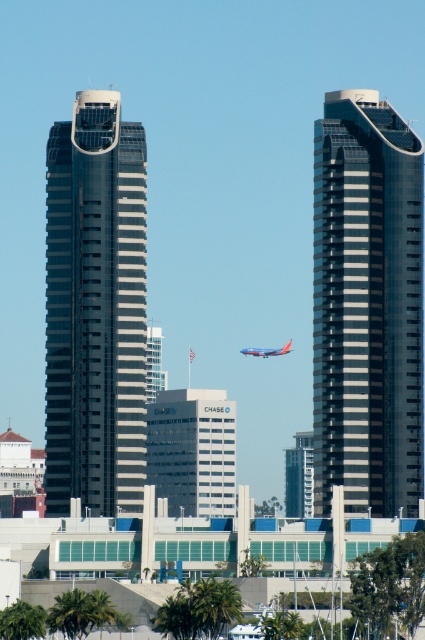
Which is in front, point (354, 465) or point (306, 483)?

Positioned in front is point (354, 465).

Can you confirm if smooth glass skyscraper at right is shorter than metallic silver elevator shaft at center?

In fact, smooth glass skyscraper at right may be taller than metallic silver elevator shaft at center.

The height and width of the screenshot is (640, 425). Describe the element at coordinates (367, 305) in the screenshot. I see `smooth glass skyscraper at right` at that location.

You are a GUI agent. You are given a task and a screenshot of the screen. Output one action in this format:
    pyautogui.click(x=<x>, y=<y>)
    Task: Click on the smooth glass skyscraper at right
    This screenshot has height=640, width=425.
    Given the screenshot: What is the action you would take?
    pyautogui.click(x=367, y=305)

Is smooth glass skyscraper at center thinner than blue matte airplane at center?

No.

Which is behind, point (64, 476) or point (249, 349)?

Positioned behind is point (64, 476).

Locate an element on the screen. smooth glass skyscraper at center is located at coordinates (96, 308).

Does smooth glass skyscraper at center have a lesser height compared to metallic silver elevator shaft at center?

No, smooth glass skyscraper at center is not shorter than metallic silver elevator shaft at center.

Is smooth glass skyscraper at center to the right of metallic silver elevator shaft at center from the viewer's perspective?

In fact, smooth glass skyscraper at center is to the left of metallic silver elevator shaft at center.

You are a GUI agent. You are given a task and a screenshot of the screen. Output one action in this format:
    pyautogui.click(x=<x>, y=<y>)
    Task: Click on the smooth glass skyscraper at center
    This screenshot has height=640, width=425.
    Given the screenshot: What is the action you would take?
    pyautogui.click(x=96, y=308)

I want to click on smooth glass skyscraper at center, so click(x=96, y=308).